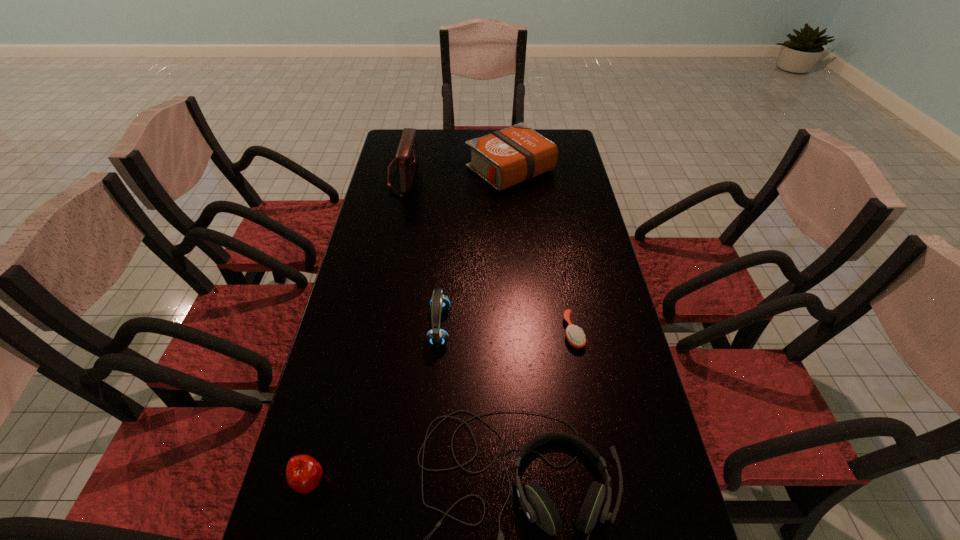
I want to click on vacant area that satisfies the following two spatial constraints: 1. on the front flap of the shoulder bag; 2. on the back side of the hairbrush, so click(370, 332).

Find the location of a particular element. This screenshot has width=960, height=540. vacant space that satisfies the following two spatial constraints: 1. on the front side of the Bible; 2. on the front flap of the shoulder bag is located at coordinates (512, 177).

At what (x,y) coordinates should I click in order to perform the action: click on vacant region that satisfies the following two spatial constraints: 1. on the back side of the shortest object; 2. on the ear cups of the farther headset. Please return your answer as a coordinate pair (x, y). This screenshot has width=960, height=540. Looking at the image, I should click on (572, 326).

I want to click on free space that satisfies the following two spatial constraints: 1. on the ear cups of the farther headset; 2. on the back side of the hairbrush, so click(x=439, y=332).